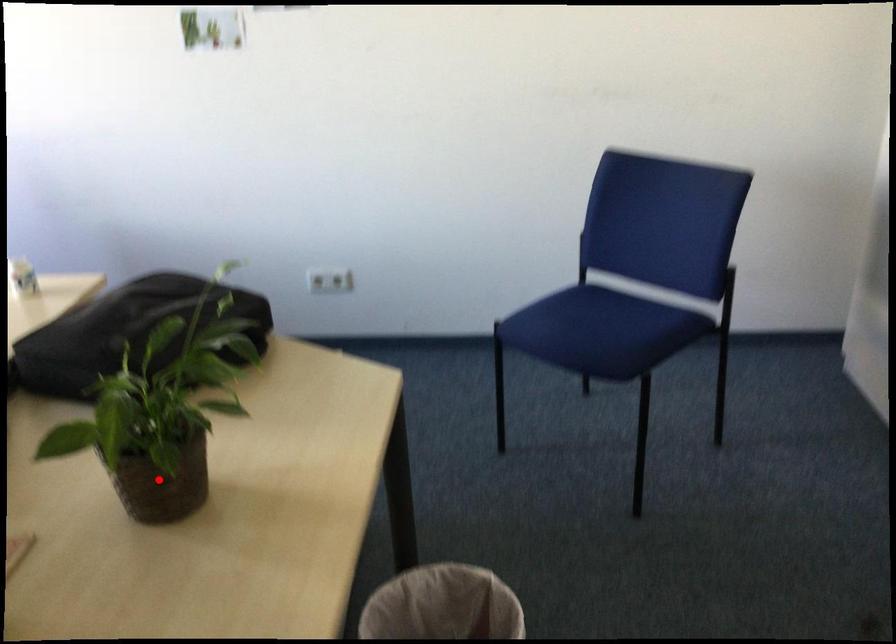
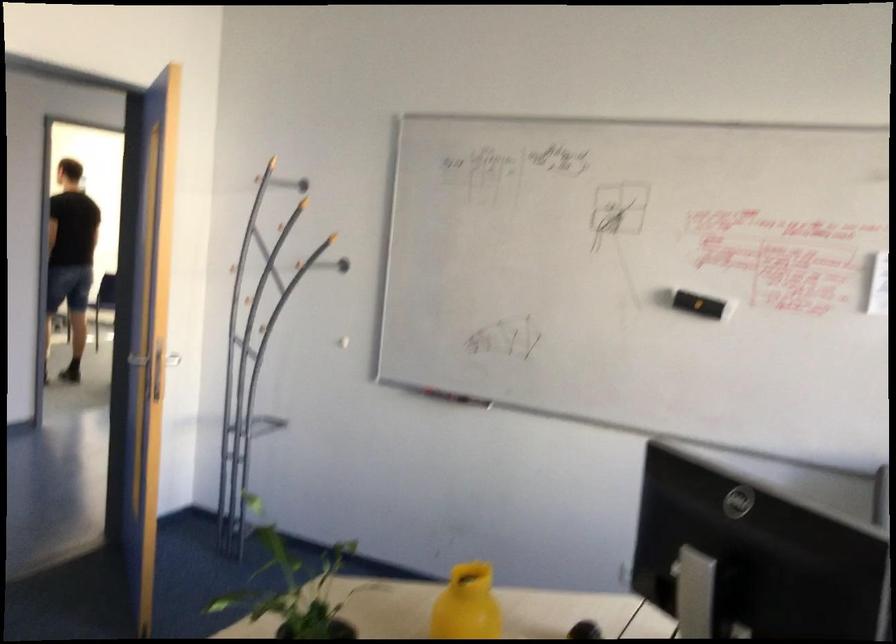
Question: I am providing you with two images of the same scene from different viewpoints. Given a red point in image1, look at the same physical point in image2. Is it:

Choices:
 (A) Closer to the viewpoint
 (B) Farther from the viewpoint

Answer: (B)